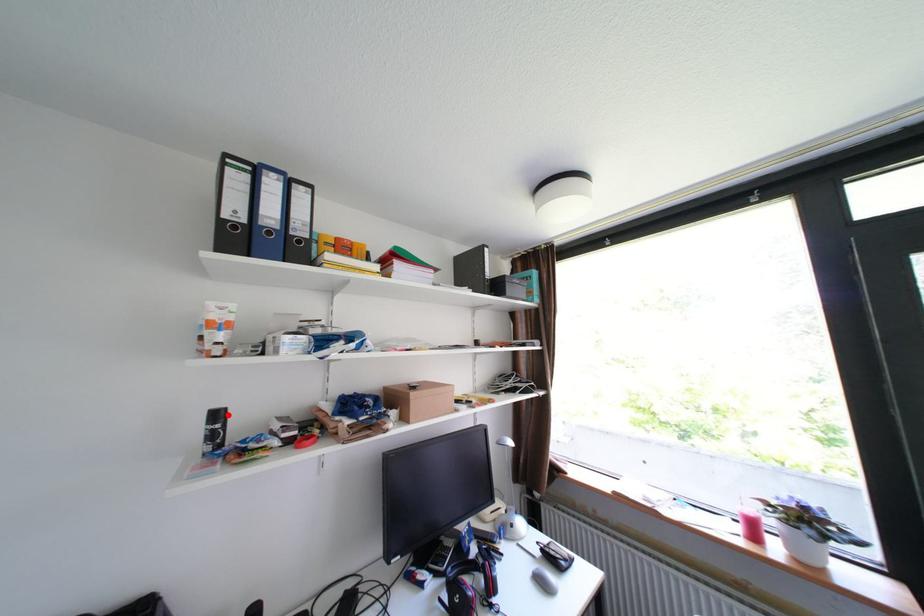
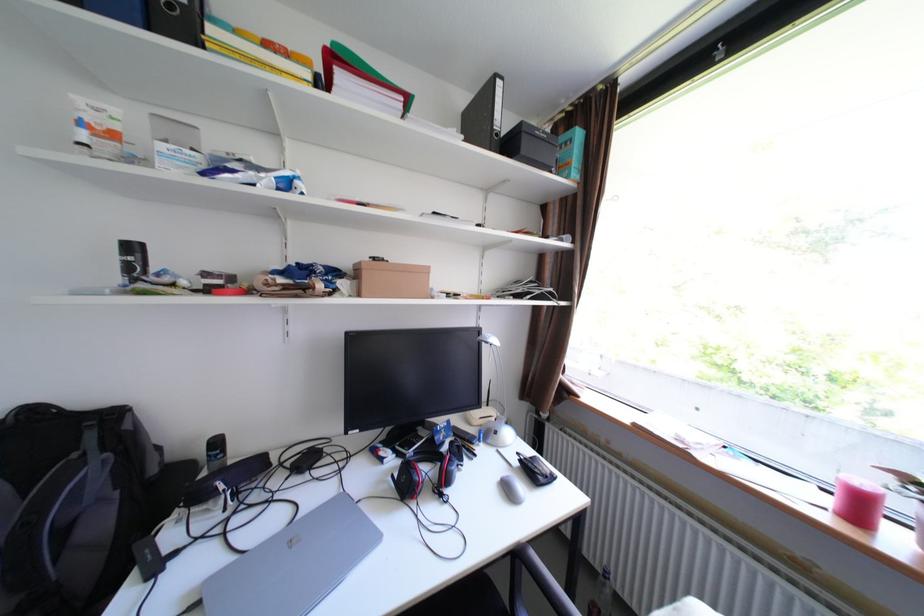
In the second image, find the point that corresponds to the highlighted location in the first image.

(143, 248)